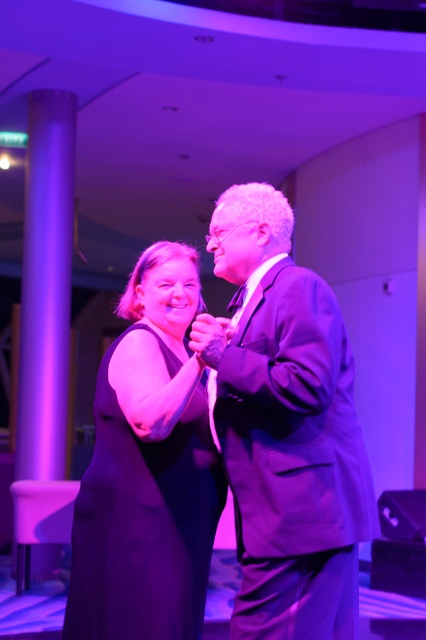
You are a photographer at a formal event. You need to capture a photo of the satin black suit at center and the matte black dress at center. The camera frame can only accommodate objects that take up a certain amount of space. Based on their sizes, which object might require more careful framing to ensure it fits within the camera frame?

The matte black dress at center occupies more space than the satin black suit at center, so it might require more careful framing to ensure it fits within the camera frame.

You are standing at the entrance of the ballroom and want to reach the point marked by point (198, 346). There is an obstacle at point (75, 637). Will you encounter the obstacle before reaching your destination?

Point (198, 346) is in front of point (75, 637), so you will reach the destination before encountering the obstacle.

You are a photographer at a formal event. You see the satin black suit at center and the matte black dress at center. Which one is positioned to the right side?

The satin black suit at center is positioned to the right of the matte black dress at center.